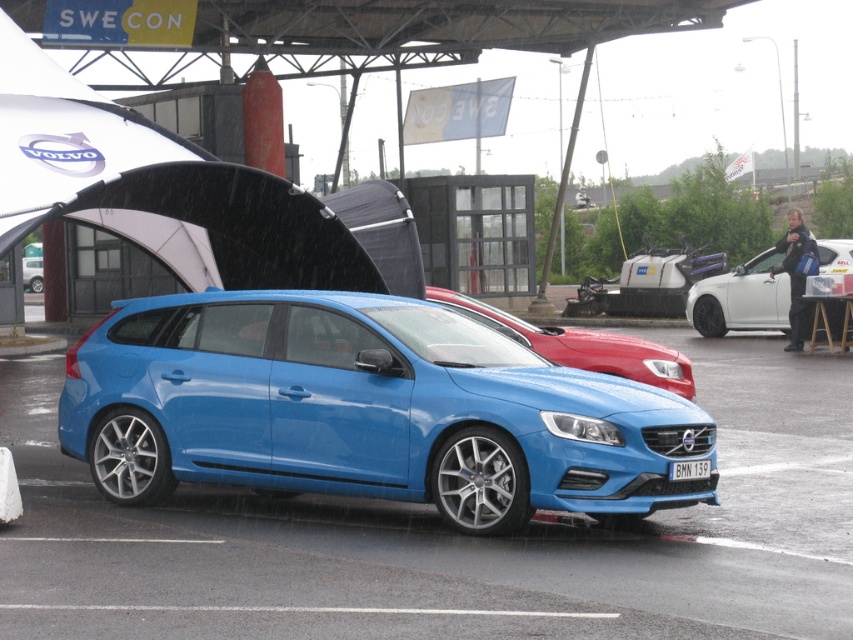
Is point (482, 454) closer to camera compared to point (701, 460)?

Yes.

The image size is (853, 640). I want to click on matte blue hatchback at center, so click(366, 410).

Locate an element on the screen. This screenshot has width=853, height=640. matte blue hatchback at center is located at coordinates 366,410.

Between point (776, 252) and point (689, 460), which one is positioned behind?

Positioned behind is point (776, 252).

Is white glossy sedan at center to the right of white plastic license plate at center from the viewer's perspective?

Correct, you'll find white glossy sedan at center to the right of white plastic license plate at center.

The width and height of the screenshot is (853, 640). Describe the element at coordinates (741, 298) in the screenshot. I see `white glossy sedan at center` at that location.

The image size is (853, 640). Find the location of `white glossy sedan at center`. white glossy sedan at center is located at coordinates (741, 298).

Locate an element on the screen. This screenshot has height=640, width=853. blue metallic hatchback at center is located at coordinates (581, 346).

Does blue metallic hatchback at center have a greater width compared to white glossy sedan at center?

Indeed, blue metallic hatchback at center has a greater width compared to white glossy sedan at center.

Where is `blue metallic hatchback at center`? This screenshot has height=640, width=853. blue metallic hatchback at center is located at coordinates (581, 346).